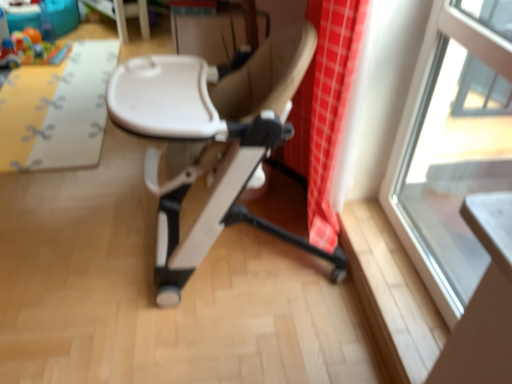
You are a GUI agent. You are given a task and a screenshot of the screen. Output one action in this format:
    pyautogui.click(x=<x>, y=<y>)
    Task: Click on the vacant space in front of beige leather chair at center
    
    Given the screenshot: What is the action you would take?
    pyautogui.click(x=229, y=335)